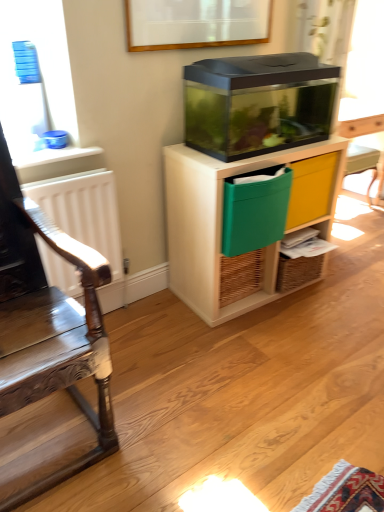
Where is `free space underneath wooden polished chair at left (from a real-world perspective)`? free space underneath wooden polished chair at left (from a real-world perspective) is located at coordinates [x=44, y=437].